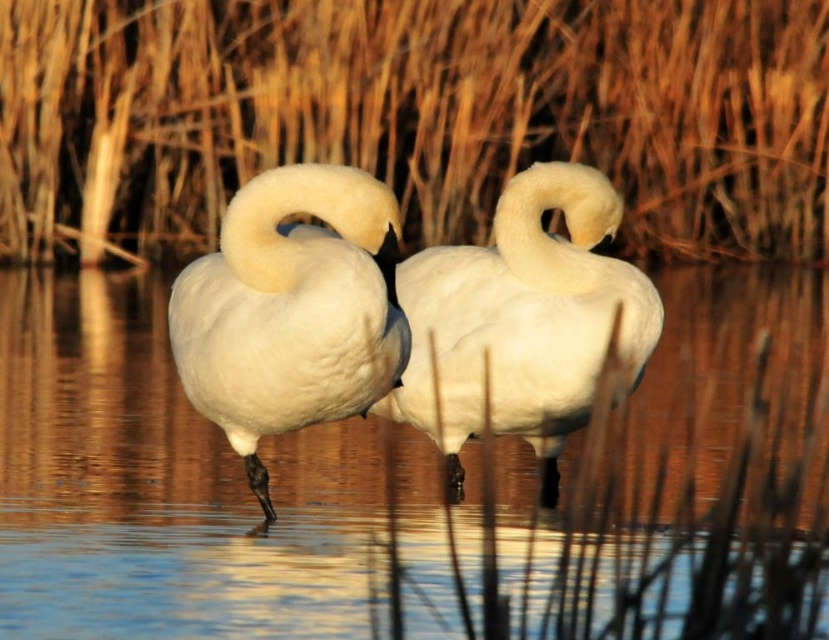
You are a photographer aiming to capture the swans in the image. To ensure the brown grass at center is in the foreground of your photo, where should you position your camera relative to the swans?

To have the brown grass at center in the foreground, position your camera closer to the brown grass at center and behind it, facing towards the swans so they appear behind the grass in the background.

You are a photographer trying to capture a closeup of the white fluffy swan at center without the brown grass at center appearing in the frame. Is it possible to do so given their sizes?

The brown grass at center occupies less space than the white fluffy swan at center, so it is possible to focus on the white fluffy swan at center while excluding the smaller brown grass at center from the frame.